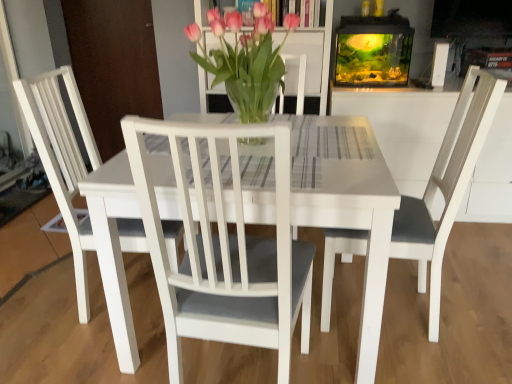
Question: Should I look upward or downward to see white matte chair at center, the 2th chair from the right?

Choices:
 (A) up
 (B) down

Answer: (B)

Question: In which direction should I rotate to look at white matte chair at center, the 1th chair positioned from the right?

Choices:
 (A) left
 (B) right

Answer: (B)

Question: Can you confirm if white matte chair at center, the 2th chair from the right, is smaller than translucent glass vase at center?

Choices:
 (A) yes
 (B) no

Answer: (B)

Question: Is white matte chair at center, which is the first chair from left to right, in contact with translucent glass vase at center?

Choices:
 (A) no
 (B) yes

Answer: (A)

Question: Could you tell me if white matte chair at center, which is the first chair from left to right, is turned towards translucent glass vase at center?

Choices:
 (A) yes
 (B) no

Answer: (A)

Question: Is white matte chair at center, the 2th chair from the right, taller than translucent glass vase at center?

Choices:
 (A) yes
 (B) no

Answer: (A)

Question: Is white matte chair at center, the 2th chair from the right, not near translucent glass vase at center?

Choices:
 (A) no
 (B) yes

Answer: (A)

Question: Does white matte chair at center, the 2th chair from the right, appear on the left side of translucent glass vase at center?

Choices:
 (A) yes
 (B) no

Answer: (A)

Question: From the image's perspective, is translucent glass vase at center under white matte chair at center, the 2th chair positioned from the left?

Choices:
 (A) yes
 (B) no

Answer: (B)

Question: Does translucent glass vase at center appear on the left side of white matte chair at center, the 1th chair positioned from the right?

Choices:
 (A) no
 (B) yes

Answer: (B)

Question: Is white matte chair at center, the 2th chair positioned from the left, surrounded by translucent glass vase at center?

Choices:
 (A) no
 (B) yes

Answer: (A)

Question: Does translucent glass vase at center appear on the right side of white matte chair at center, the 1th chair positioned from the right?

Choices:
 (A) no
 (B) yes

Answer: (A)

Question: Is the depth of translucent glass vase at center less than that of white matte chair at center, the 2th chair positioned from the left?

Choices:
 (A) yes
 (B) no

Answer: (B)

Question: Is translucent glass vase at center located outside white matte chair at center, the 2th chair positioned from the left?

Choices:
 (A) yes
 (B) no

Answer: (A)

Question: Are white matte chair at center, the 2th chair positioned from the left, and translucent glass vase at center far apart?

Choices:
 (A) no
 (B) yes

Answer: (A)